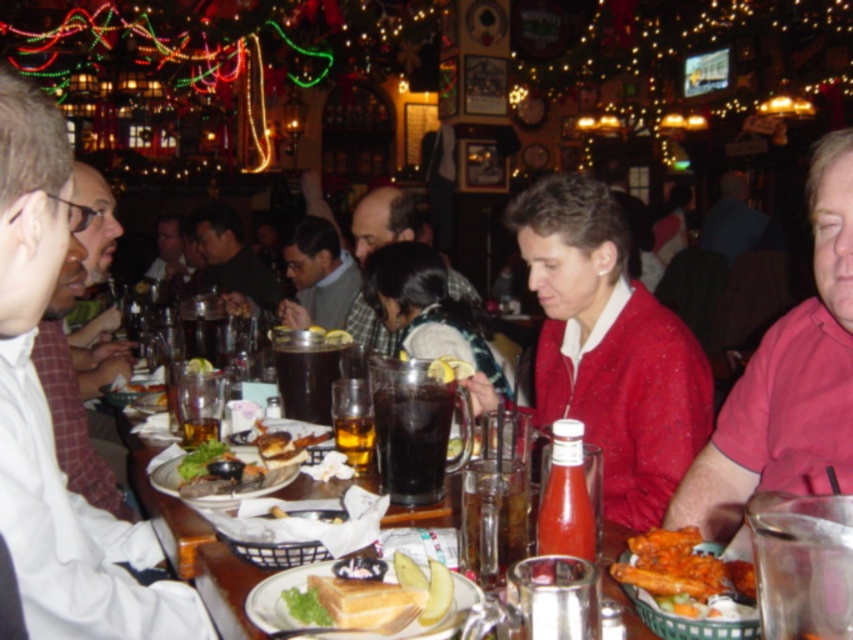
Question: Does golden brown bread at center appear under translucent glass beer at table center?

Choices:
 (A) no
 (B) yes

Answer: (B)

Question: Which of the following is the farthest from the observer?

Choices:
 (A) spicy orange chicken at lower right
 (B) smooth brown leather jacket at center
 (C) dark glass at center
 (D) red matte sweater at center

Answer: (B)

Question: Which of the following is the closest to the observer?

Choices:
 (A) dark brown liquid at center
 (B) matte black jacket at center
 (C) golden toasted bread at center
 (D) smooth brown leather jacket at center

Answer: (C)

Question: Does white plaid shirt at left have a greater width compared to translucent glass beer at table left?

Choices:
 (A) no
 (B) yes

Answer: (B)

Question: Which of the following is the farthest from the observer?

Choices:
 (A) (750, 577)
 (B) (376, 408)
 (C) (468, 563)

Answer: (B)

Question: Can you confirm if white plaid shirt at left is smaller than matte black jacket at center?

Choices:
 (A) yes
 (B) no

Answer: (B)